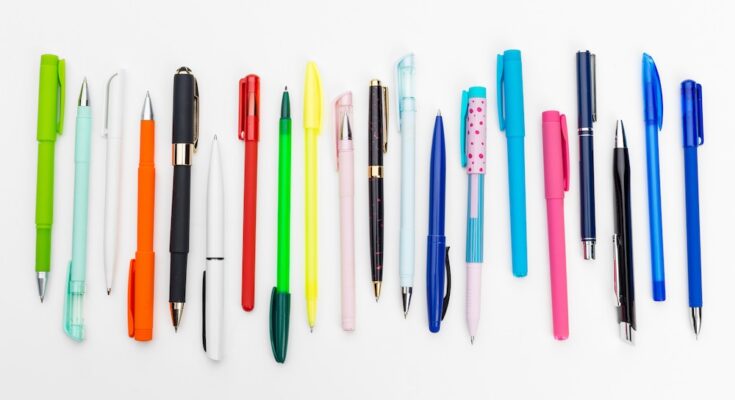
At what (x,y) coordinates should I click in order to perform the action: click on pens with tips facing down. Please return your answer as a coordinate pair (x, y). Looking at the image, I should click on (40, 208), (115, 106), (179, 149), (245, 137), (312, 215), (376, 271), (405, 270), (469, 279), (695, 316), (584, 244).